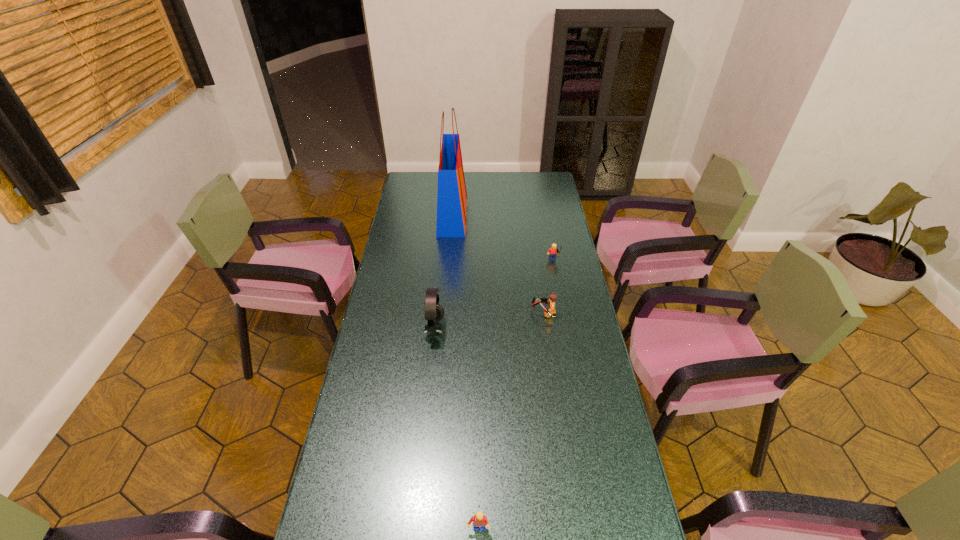
Image resolution: width=960 pixels, height=540 pixels. Find the location of `the farthest object`. the farthest object is located at coordinates (452, 198).

Find the location of a particular element. This screenshot has width=960, height=540. shopping bag is located at coordinates (452, 198).

Where is `the second tallest object`? the second tallest object is located at coordinates (434, 312).

You are a GUI agent. You are given a task and a screenshot of the screen. Output one action in this format:
    pyautogui.click(x=<x>, y=<y>)
    Task: Click on the second farthest object
    The height and width of the screenshot is (540, 960).
    Given the screenshot: What is the action you would take?
    pyautogui.click(x=553, y=251)

Image resolution: width=960 pixels, height=540 pixels. Identify the location of the rightmost Lego. (553, 251).

This screenshot has width=960, height=540. Find the location of `the second nearest Lego`. the second nearest Lego is located at coordinates pos(552,297).

Find the location of `the second Lego from right to left`. the second Lego from right to left is located at coordinates (552, 297).

Locate an element on the screen. the nearest object is located at coordinates (479, 519).

Where is `the shortest object`? This screenshot has width=960, height=540. the shortest object is located at coordinates (479, 519).

Where is `vacant space located on the handle side of the tallest object`? Image resolution: width=960 pixels, height=540 pixels. vacant space located on the handle side of the tallest object is located at coordinates (495, 216).